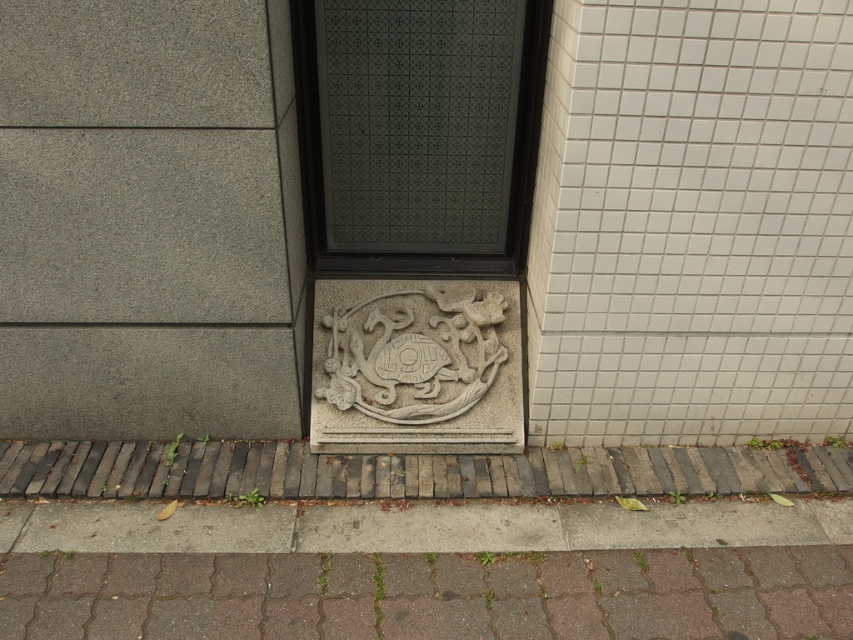
Question: Which object is closer to the camera taking this photo?

Choices:
 (A) gray stone carving at center
 (B) brown brick pavement at lower center

Answer: (B)

Question: In this image, where is brown brick pavement at lower center located relative to gray stone carving at center?

Choices:
 (A) left
 (B) right

Answer: (B)

Question: Does brown brick pavement at lower center appear on the left side of gray stone carving at center?

Choices:
 (A) yes
 (B) no

Answer: (B)

Question: From the image, what is the correct spatial relationship of brown brick pavement at lower center in relation to gray stone carving at center?

Choices:
 (A) below
 (B) above

Answer: (A)

Question: Which of the following is the farthest from the observer?

Choices:
 (A) gray stone carving at center
 (B) brown brick pavement at lower center

Answer: (A)